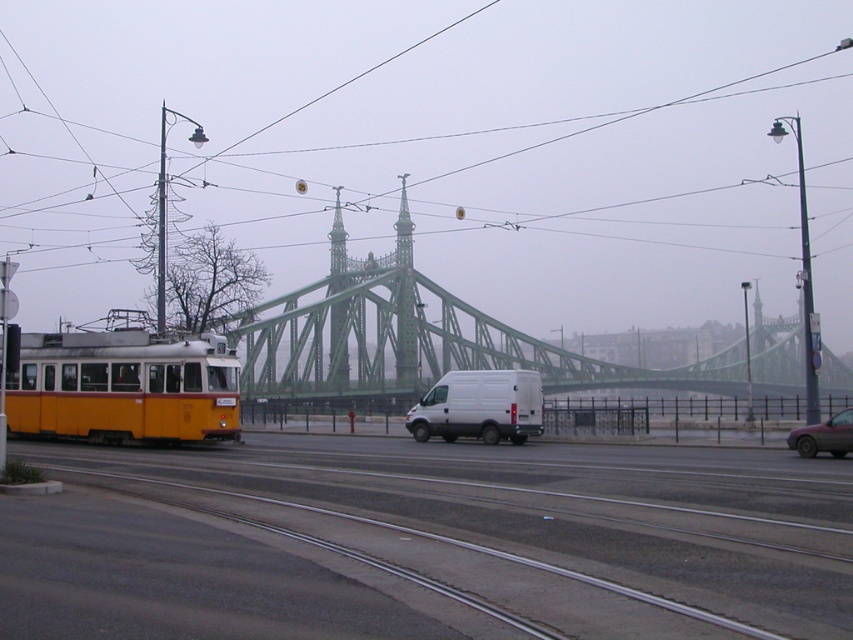
Between point (531, 504) and point (836, 420), which one is positioned behind?

The point (836, 420) is behind.

How much distance is there between metallic gray tracks at center and metallic red car at lower right?

metallic gray tracks at center is 13.77 meters away from metallic red car at lower right.

Is point (329, 595) less distant than point (851, 420)?

Yes, it is.

This screenshot has width=853, height=640. Find the location of `metallic gray tracks at center`. metallic gray tracks at center is located at coordinates (427, 541).

Is green metal bridge at center below white matte van at center?

No, green metal bridge at center is not below white matte van at center.

Is point (318, 381) in front of point (508, 424)?

No, it is not.

Is point (401, 273) closer to viewer compared to point (428, 426)?

That is False.

Locate an element on the screen. The image size is (853, 640). green metal bridge at center is located at coordinates (415, 337).

Does white matte van at center lie in front of metallic red car at lower right?

No, it is not.

Is point (439, 378) farther from viewer compared to point (819, 449)?

Yes, point (439, 378) is farther from viewer.

What do you see at coordinates (479, 406) in the screenshot? I see `white matte van at center` at bounding box center [479, 406].

The width and height of the screenshot is (853, 640). I want to click on white matte van at center, so click(479, 406).